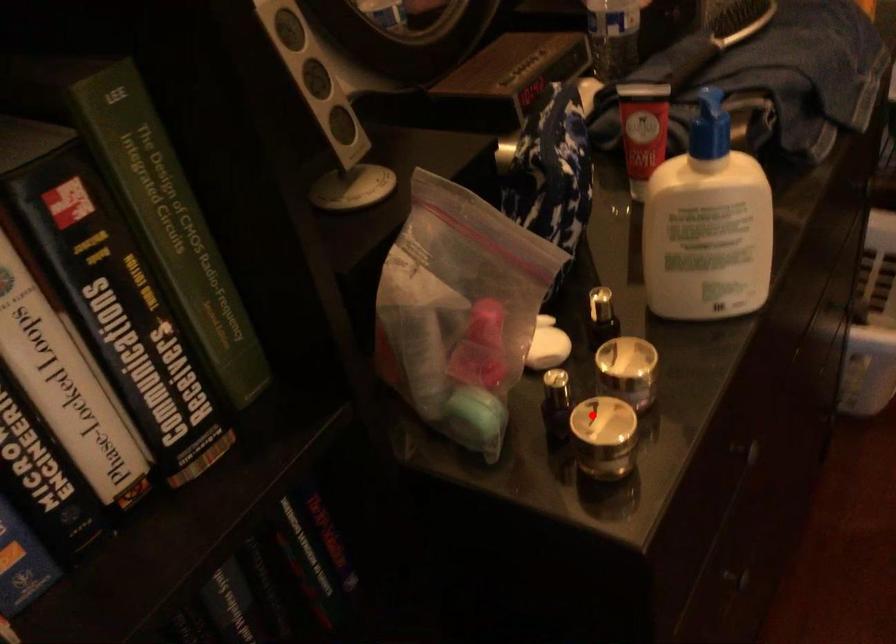
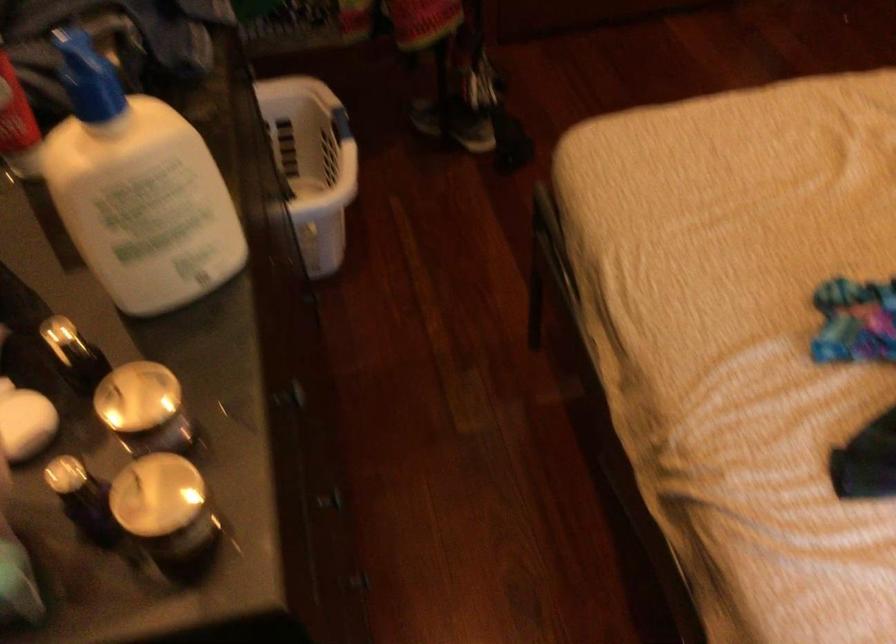
Question: I am providing you with two images of the same scene from different viewpoints. Given a red point in image1, look at the same physical point in image2. Is it:

Choices:
 (A) Closer to the viewpoint
 (B) Farther from the viewpoint

Answer: (A)